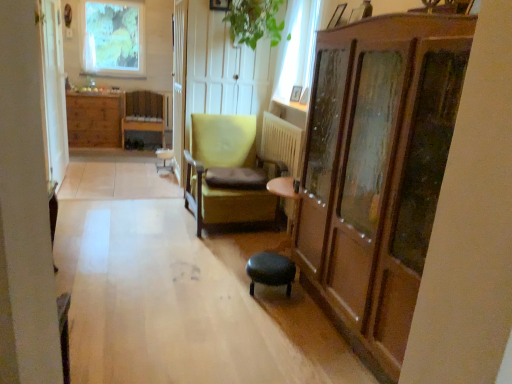
Locate an element on the screen. The width and height of the screenshot is (512, 384). vacant space to the right of white wood screen door at left, the 2th screen door when ordered from right to left is located at coordinates (99, 187).